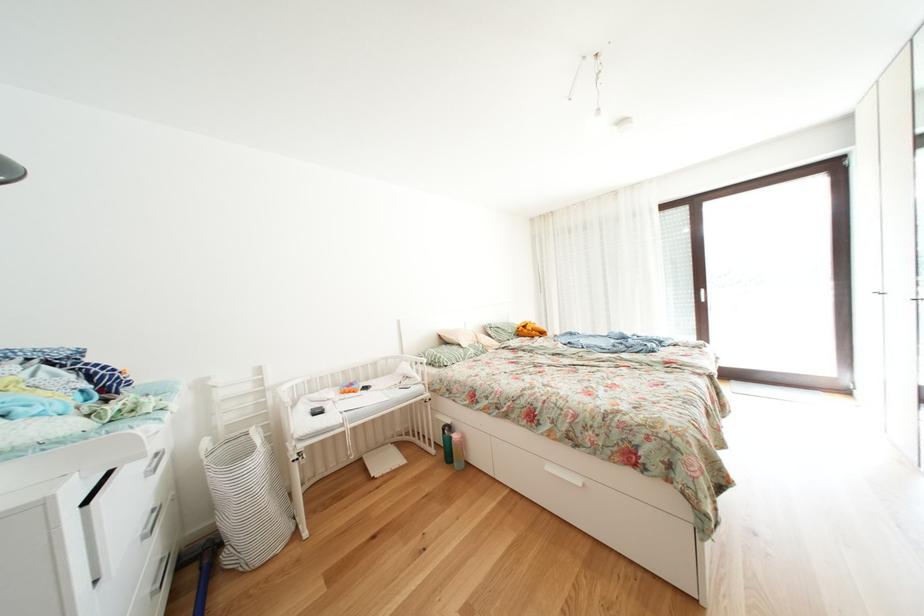
Find where to lift the pink water bottle. Please return your answer as a coordinate pair (x, y).

(457, 450)